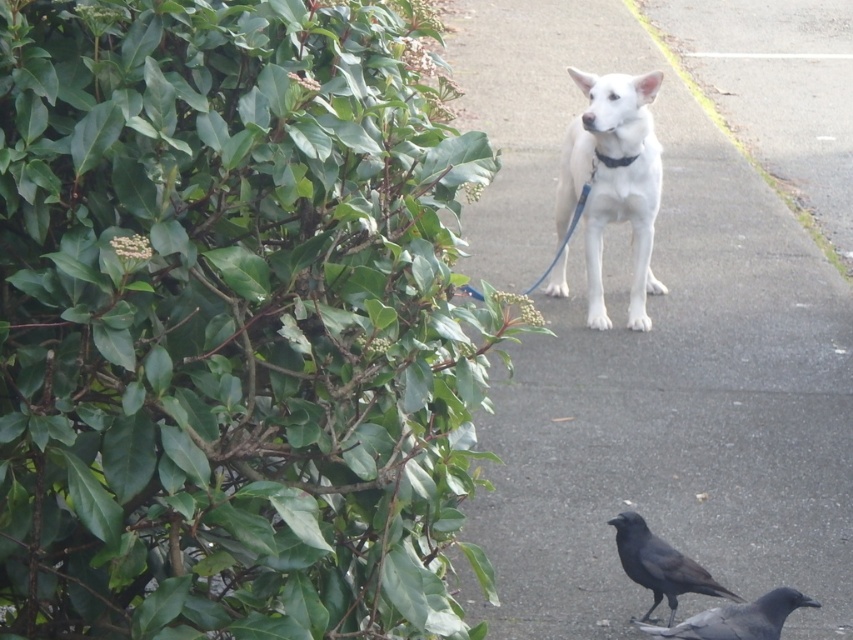
Question: Which point appears closest to the camera in this image?

Choices:
 (A) (642, 518)
 (B) (610, 568)
 (C) (799, 602)

Answer: (C)

Question: Which point is farther to the camera?

Choices:
 (A) (643, 579)
 (B) (779, 209)

Answer: (B)

Question: Is green leafy hedge at upper left to the right of smooth concrete sidewalk at center from the viewer's perspective?

Choices:
 (A) no
 (B) yes

Answer: (A)

Question: Which point is closer to the camera?

Choices:
 (A) (71, 244)
 (B) (637, 113)
 (C) (675, 592)

Answer: (A)

Question: Does smooth concrete sidewalk at center lie in front of white matte dog at center?

Choices:
 (A) no
 (B) yes

Answer: (A)

Question: Does shiny black crow at lower right appear under black fabric neckband at center?

Choices:
 (A) no
 (B) yes

Answer: (B)